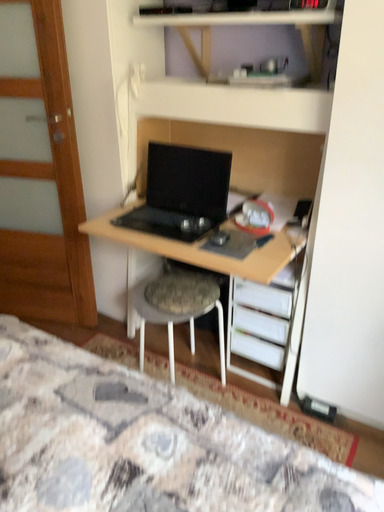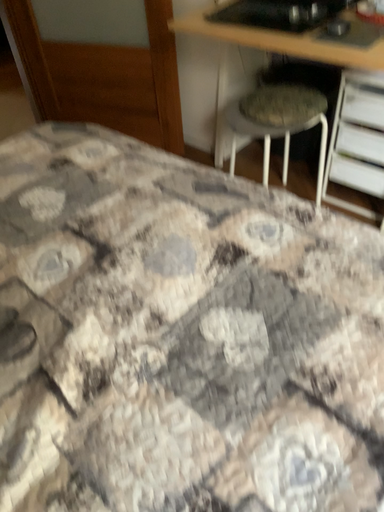
Question: Which way did the camera rotate in the video?

Choices:
 (A) rotated downward
 (B) rotated upward

Answer: (A)